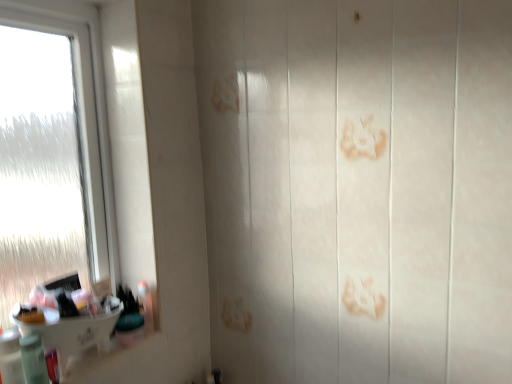
This screenshot has height=384, width=512. I want to click on green plastic container at lower left, the 1th toiletry in the right-to-left sequence, so click(129, 319).

Where is `translucent plastic bottle at lower left, which is the third toiletry in right-to-left order`? The height and width of the screenshot is (384, 512). translucent plastic bottle at lower left, which is the third toiletry in right-to-left order is located at coordinates [33, 360].

Image resolution: width=512 pixels, height=384 pixels. Identify the location of green plastic container at lower left, the first toiletry in the back-to-front sequence. (129, 319).

Considering the sizes of translucent plastic tube at lower left, acting as the second toiletry starting from the right, and translucent plastic bottle at lower left, which is the second toiletry in left-to-right order, in the image, is translucent plastic tube at lower left, acting as the second toiletry starting from the right, taller or shorter than translucent plastic bottle at lower left, which is the second toiletry in left-to-right order,?

translucent plastic tube at lower left, acting as the second toiletry starting from the right, is shorter than translucent plastic bottle at lower left, which is the second toiletry in left-to-right order.

Which of these two, translucent plastic tube at lower left, acting as the second toiletry starting from the right, or translucent plastic bottle at lower left, which appears as the 2th toiletry when viewed from the front, is smaller?

translucent plastic tube at lower left, acting as the second toiletry starting from the right, is smaller.

How far apart are translucent plastic tube at lower left, marked as the 2th toiletry in a back-to-front arrangement, and translucent plastic bottle at lower left, which appears as the 2th toiletry when viewed from the front?

They are 1.26 inches apart.

Is translucent plastic tube at lower left, acting as the second toiletry starting from the right, in contact with translucent plastic bottle at lower left, which is the third toiletry in right-to-left order?

Yes, translucent plastic tube at lower left, acting as the second toiletry starting from the right, is next to translucent plastic bottle at lower left, which is the third toiletry in right-to-left order.

Does translucent plastic bottle at lower left, which is the second toiletry in left-to-right order, appear on the right side of transparent frosted glass at left?

Yes.

Which of these two, translucent plastic bottle at lower left, which is the 3th toiletry in back-to-front order, or transparent frosted glass at left, is wider?

Wider between the two is transparent frosted glass at left.

Is translucent plastic bottle at lower left, which is the 3th toiletry in back-to-front order, placed right next to transparent frosted glass at left?

translucent plastic bottle at lower left, which is the 3th toiletry in back-to-front order, is not next to transparent frosted glass at left, and they're not touching.

Is white glossy sink at lower left to the right of translucent plastic tube at lower left, marked as the 2th toiletry in a back-to-front arrangement, from the viewer's perspective?

In fact, white glossy sink at lower left is to the left of translucent plastic tube at lower left, marked as the 2th toiletry in a back-to-front arrangement.

Can you confirm if white glossy sink at lower left is taller than translucent plastic tube at lower left, acting as the second toiletry starting from the right?

Yes.

Looking at this image, considering the relative positions of white glossy sink at lower left and translucent plastic tube at lower left, the 3th toiletry when ordered from left to right, in the image provided, is white glossy sink at lower left in front of translucent plastic tube at lower left, the 3th toiletry when ordered from left to right,?

Yes, white glossy sink at lower left is closer to the viewer.

Which is behind, point (58, 349) or point (49, 357)?

Point (58, 349)

Identify the location of window above the green plastic container at lower left, the 1th toiletry in the right-to-left sequence (from the image's perspective). (95, 112).

From the picture: Is transparent frosted glass at left behind green plastic container at lower left, which is the fourth toiletry from left to right?

No, transparent frosted glass at left is closer to the viewer.

Looking at this image, how distant is transparent frosted glass at left from green plastic container at lower left, which is the fourth toiletry from left to right?

The distance of transparent frosted glass at left from green plastic container at lower left, which is the fourth toiletry from left to right, is 14.91 inches.

From the image's perspective, which one is positioned higher, transparent frosted glass at left or green plastic container at lower left, the 1th toiletry in the right-to-left sequence?

transparent frosted glass at left.

Is translucent plastic bottle at lower left, positioned as the 1th toiletry in left-to-right order, to the left or to the right of translucent plastic bottle at lower left, which is the 3th toiletry in back-to-front order, in the image?

Based on their positions, translucent plastic bottle at lower left, positioned as the 1th toiletry in left-to-right order, is located to the left of translucent plastic bottle at lower left, which is the 3th toiletry in back-to-front order.

Would you say translucent plastic bottle at lower left, which appears as the first toiletry when viewed from the front, is a long distance from translucent plastic bottle at lower left, which is the 3th toiletry in back-to-front order?

Actually, translucent plastic bottle at lower left, which appears as the first toiletry when viewed from the front, and translucent plastic bottle at lower left, which is the 3th toiletry in back-to-front order, are a little close together.

In the scene shown: From the image's perspective, does translucent plastic bottle at lower left, which appears as the first toiletry when viewed from the front, appear higher than translucent plastic bottle at lower left, which is the second toiletry in left-to-right order?

Yes, from the image's perspective, translucent plastic bottle at lower left, which appears as the first toiletry when viewed from the front, is above translucent plastic bottle at lower left, which is the second toiletry in left-to-right order.

Is translucent plastic bottle at lower left, which appears as the first toiletry when viewed from the front, completely or partially outside of translucent plastic bottle at lower left, which is the third toiletry in right-to-left order?

Yes.

Considering the sizes of translucent plastic bottle at lower left, positioned as the 1th toiletry in left-to-right order, and translucent plastic tube at lower left, acting as the second toiletry starting from the right, in the image, is translucent plastic bottle at lower left, positioned as the 1th toiletry in left-to-right order, wider or thinner than translucent plastic tube at lower left, acting as the second toiletry starting from the right,?

translucent plastic bottle at lower left, positioned as the 1th toiletry in left-to-right order, is wider than translucent plastic tube at lower left, acting as the second toiletry starting from the right.

How many degrees apart are the facing directions of translucent plastic bottle at lower left, the fourth toiletry in the back-to-front sequence, and translucent plastic tube at lower left, the third toiletry positioned from the front?

The angle between the facing direction of translucent plastic bottle at lower left, the fourth toiletry in the back-to-front sequence, and the facing direction of translucent plastic tube at lower left, the third toiletry positioned from the front, is 0.000297 degrees.

Would you say translucent plastic bottle at lower left, the 4th toiletry in the right-to-left sequence, is a long distance from translucent plastic tube at lower left, the 3th toiletry when ordered from left to right?

No.

In the scene shown: Is translucent plastic tube at lower left, the 3th toiletry when ordered from left to right, far from green plastic container at lower left, the 1th toiletry in the right-to-left sequence?

translucent plastic tube at lower left, the 3th toiletry when ordered from left to right, is near green plastic container at lower left, the 1th toiletry in the right-to-left sequence, not far away.

Between translucent plastic tube at lower left, the third toiletry positioned from the front, and green plastic container at lower left, the first toiletry in the back-to-front sequence, which one appears on the left side from the viewer's perspective?

translucent plastic tube at lower left, the third toiletry positioned from the front, is more to the left.

From the picture: Considering the sizes of objects translucent plastic tube at lower left, the 3th toiletry when ordered from left to right, and green plastic container at lower left, the 4th toiletry from the front, in the image provided, who is shorter, translucent plastic tube at lower left, the 3th toiletry when ordered from left to right, or green plastic container at lower left, the 4th toiletry from the front,?

green plastic container at lower left, the 4th toiletry from the front.

I want to click on the 1st toiletry directly above the translucent plastic tube at lower left, the third toiletry positioned from the front (from a real-world perspective), so point(33,360).

From the transparent frosted glass at left, count 2nd toiletry to the right and point to it. Please provide its 2D coordinates.

[(33, 360)]

Which object lies nearer to the anchor point green plastic container at lower left, the first toiletry in the back-to-front sequence, transparent frosted glass at left or translucent plastic bottle at lower left, the 4th toiletry in the right-to-left sequence?

Based on the image, translucent plastic bottle at lower left, the 4th toiletry in the right-to-left sequence, appears to be nearer to green plastic container at lower left, the first toiletry in the back-to-front sequence.

Looking at the image, which one is located closer to translucent plastic tube at lower left, the third toiletry positioned from the front, green plastic container at lower left, the 1th toiletry in the right-to-left sequence, or translucent plastic bottle at lower left, the fourth toiletry in the back-to-front sequence?

Based on the image, translucent plastic bottle at lower left, the fourth toiletry in the back-to-front sequence, appears to be nearer to translucent plastic tube at lower left, the third toiletry positioned from the front.

From the image, which object appears to be nearer to transparent frosted glass at left, translucent plastic tube at lower left, the third toiletry positioned from the front, or translucent plastic bottle at lower left, positioned as the 1th toiletry in left-to-right order?

translucent plastic bottle at lower left, positioned as the 1th toiletry in left-to-right order.

Which object lies further to the anchor point translucent plastic bottle at lower left, the 4th toiletry in the right-to-left sequence, translucent plastic tube at lower left, the 3th toiletry when ordered from left to right, or white glossy sink at lower left?

The object further to translucent plastic bottle at lower left, the 4th toiletry in the right-to-left sequence, is white glossy sink at lower left.

From the image, which object appears to be farther from green plastic container at lower left, the 1th toiletry in the right-to-left sequence, translucent plastic tube at lower left, the third toiletry positioned from the front, or white glossy sink at lower left?

The object further to green plastic container at lower left, the 1th toiletry in the right-to-left sequence, is translucent plastic tube at lower left, the third toiletry positioned from the front.

Based on their spatial positions, is green plastic container at lower left, the 4th toiletry from the front, or translucent plastic bottle at lower left, which appears as the 2th toiletry when viewed from the front, further from transparent frosted glass at left?

Based on the image, translucent plastic bottle at lower left, which appears as the 2th toiletry when viewed from the front, appears to be further to transparent frosted glass at left.

Estimate the real-world distances between objects in this image. Which object is closer to translucent plastic bottle at lower left, which appears as the first toiletry when viewed from the front, translucent plastic tube at lower left, the 3th toiletry when ordered from left to right, or transparent frosted glass at left?

Based on the image, translucent plastic tube at lower left, the 3th toiletry when ordered from left to right, appears to be nearer to translucent plastic bottle at lower left, which appears as the first toiletry when viewed from the front.

Looking at the image, which one is located further to translucent plastic bottle at lower left, which is the second toiletry in left-to-right order, transparent frosted glass at left or translucent plastic bottle at lower left, the 4th toiletry in the right-to-left sequence?

Among the two, transparent frosted glass at left is located further to translucent plastic bottle at lower left, which is the second toiletry in left-to-right order.

Where is `sink between transparent frosted glass at left and translucent plastic bottle at lower left, which is the second toiletry in left-to-right order, vertically`? Image resolution: width=512 pixels, height=384 pixels. sink between transparent frosted glass at left and translucent plastic bottle at lower left, which is the second toiletry in left-to-right order, vertically is located at coordinates (72, 321).

I want to click on sink located between translucent plastic bottle at lower left, which is the second toiletry in left-to-right order, and green plastic container at lower left, the 4th toiletry from the front, in the depth direction, so click(x=72, y=321).

Identify the location of toiletry positioned between translucent plastic bottle at lower left, which is the third toiletry in right-to-left order, and green plastic container at lower left, the first toiletry in the back-to-front sequence, from near to far. Image resolution: width=512 pixels, height=384 pixels. (52, 365).

You are a GUI agent. You are given a task and a screenshot of the screen. Output one action in this format:
    pyautogui.click(x=<x>, y=<y>)
    Task: Click on the sink between translucent plastic bottle at lower left, which appears as the first toiletry when viewed from the front, and green plastic container at lower left, the 1th toiletry in the right-to-left sequence, from front to back
    
    Given the screenshot: What is the action you would take?
    pyautogui.click(x=72, y=321)